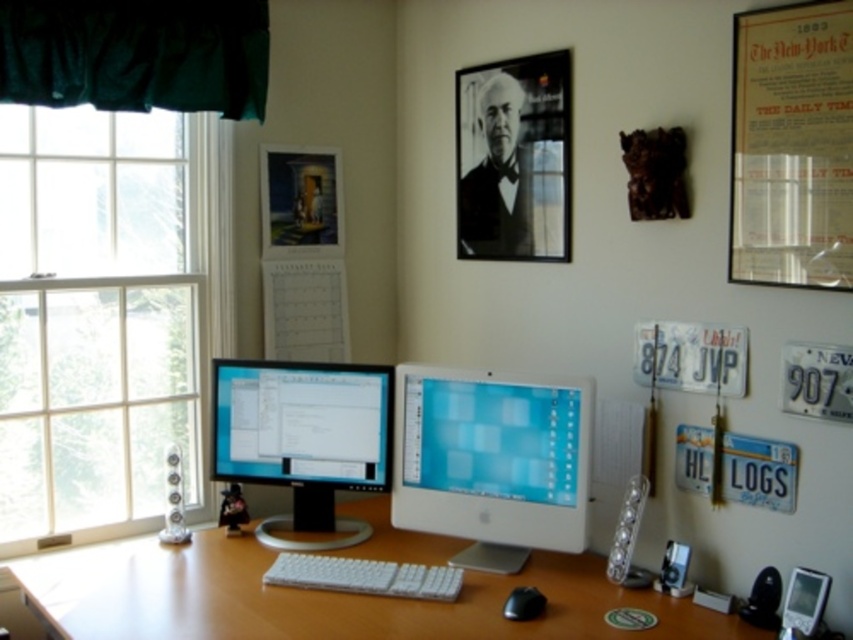
Question: Is black matte portrait at upper center thinner than white paper calendar at center?

Choices:
 (A) yes
 (B) no

Answer: (B)

Question: Is dark green fabric curtain at upper left positioned behind white paper calendar at center?

Choices:
 (A) no
 (B) yes

Answer: (A)

Question: Which is farther from the matte wooden picture frame at upper center?

Choices:
 (A) matte black monitor at center
 (B) white paper calendar at center
 (C) matte paper poster at upper right
 (D) white plastic keyboard at center

Answer: (C)

Question: Where is matte paper poster at upper right located in relation to dark green fabric curtain at upper left in the image?

Choices:
 (A) left
 (B) right

Answer: (B)

Question: Which is nearer to the white plastic keyboard at center?

Choices:
 (A) matte paper poster at upper right
 (B) black matte portrait at upper center
 (C) white paper calendar at center

Answer: (C)

Question: Which point is farther from the camera taking this photo?

Choices:
 (A) (384, 568)
 (B) (213, 477)

Answer: (B)